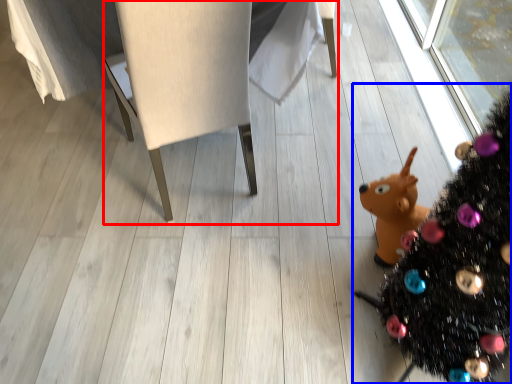
Question: Which of the following is the farthest to the observer, furniture (highlighted by a red box) or christmas tree (highlighted by a blue box)?

Choices:
 (A) furniture
 (B) christmas tree

Answer: (A)